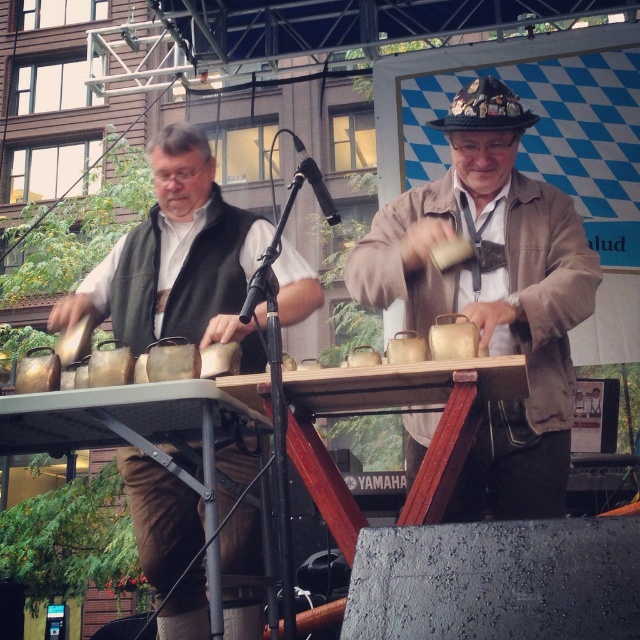
Which is more to the left, matte brown leather jacket at center or matte black vest at left?

matte black vest at left

Can you confirm if matte brown leather jacket at center is thinner than matte black vest at left?

Indeed, matte brown leather jacket at center has a lesser width compared to matte black vest at left.

The image size is (640, 640). Describe the element at coordinates (492, 294) in the screenshot. I see `matte brown leather jacket at center` at that location.

Locate an element on the screen. matte brown leather jacket at center is located at coordinates (492, 294).